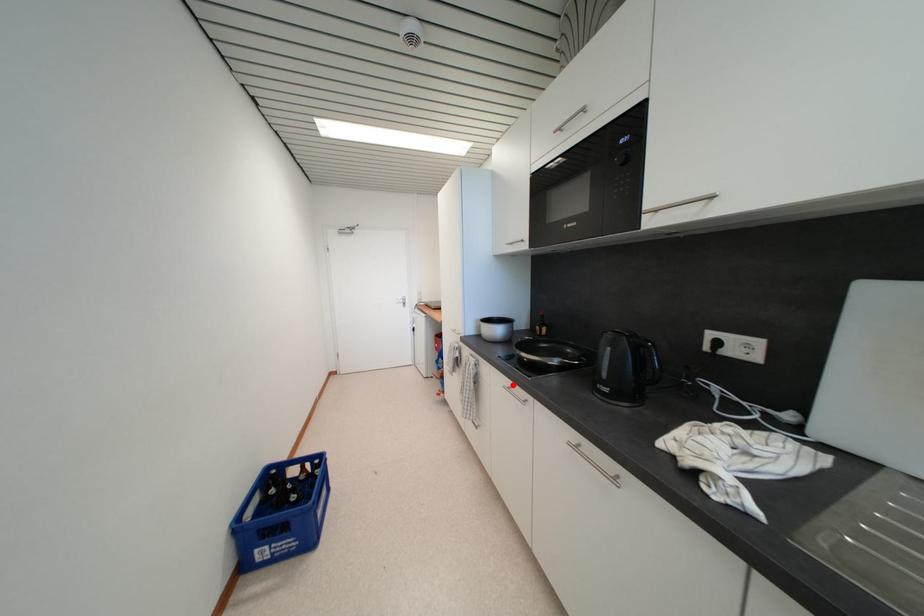
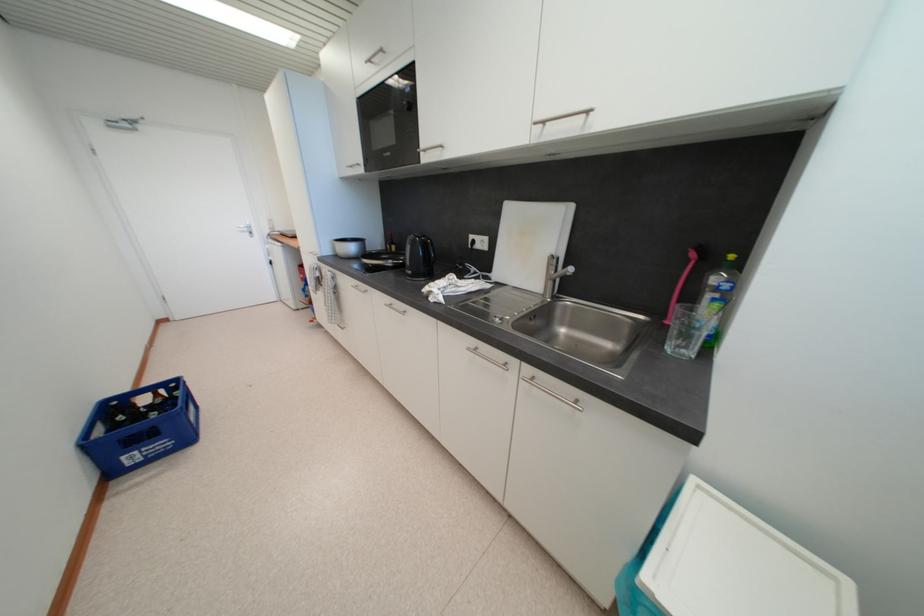
Where in the second image is the point corresponding to the highlighted location from the first image?

(359, 285)